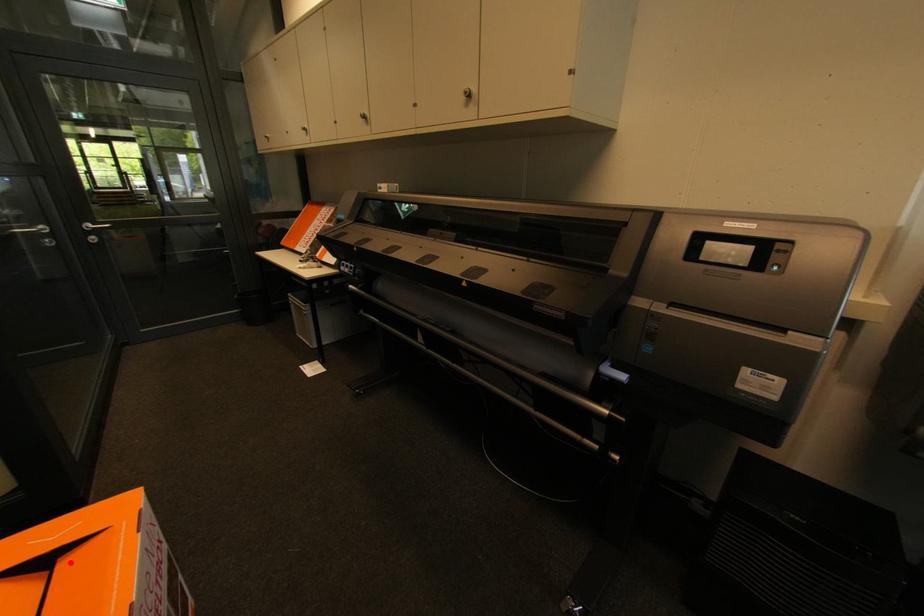
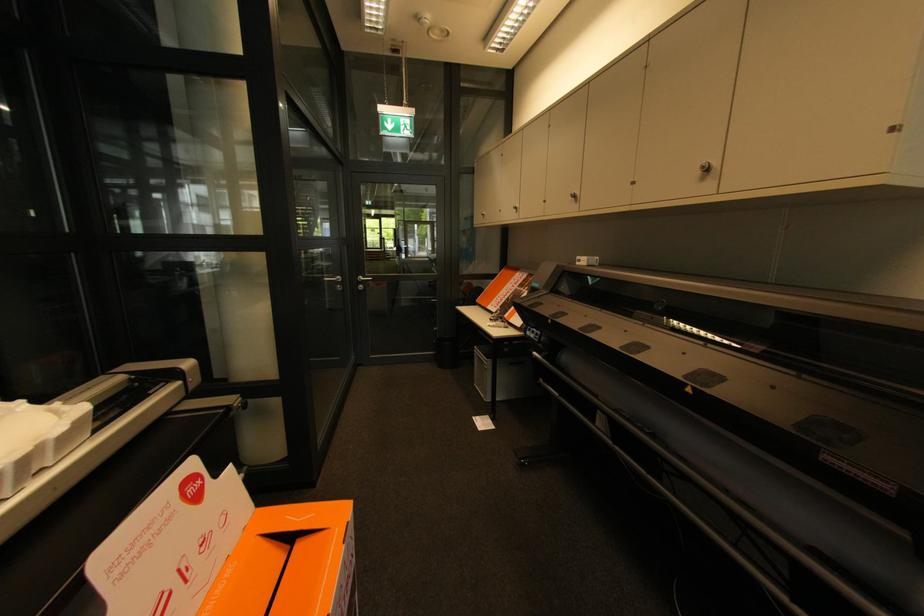
Question: I am providing you with two images of the same scene from different viewpoints. In image1, a red point is highlighted. Considering the same 3D point in image2, which of the following is correct?

Choices:
 (A) It is closer
 (B) It is farther

Answer: (A)